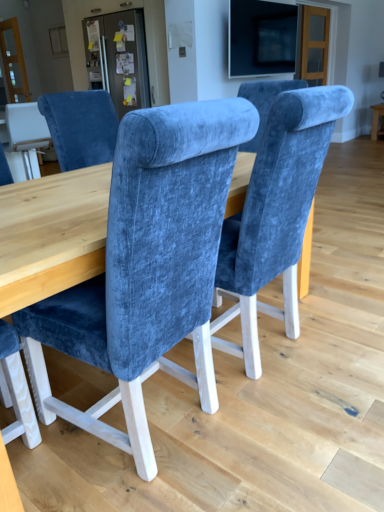
Question: Choose the correct answer: Is velvet blue chair at center inside matte wood table at right or outside it?

Choices:
 (A) outside
 (B) inside

Answer: (A)

Question: From a real-world perspective, relative to matte wood table at right, is velvet blue chair at center vertically above or below?

Choices:
 (A) above
 (B) below

Answer: (A)

Question: Which object is positioned farthest from the matte wood table at right?

Choices:
 (A) matte black screen at upper center
 (B) velvet blue chair at center

Answer: (B)

Question: Which object is positioned closest to the velvet blue chair at center?

Choices:
 (A) matte black screen at upper center
 (B) matte wood table at right

Answer: (A)